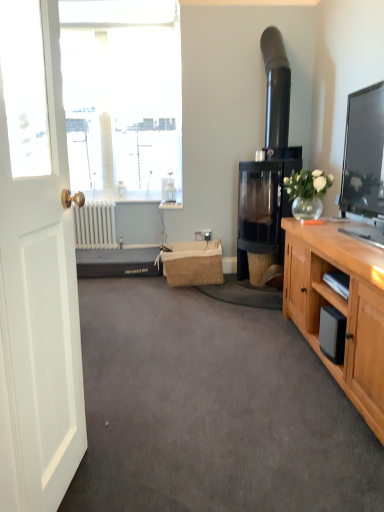
Find the location of a particular element. This screenshot has width=384, height=512. white matte door at left is located at coordinates 39,315.

In order to face black glass fireplace at center-right, should I rotate leftwards or rightwards?

Turn right approximately 11.766 degrees to face it.

Locate an element on the screen. The width and height of the screenshot is (384, 512). burlap picnic basket at center is located at coordinates (193, 263).

This screenshot has height=512, width=384. Describe the element at coordinates (307, 192) in the screenshot. I see `translucent glass vase at upper right` at that location.

Find the location of a particular element. gray carpet at center is located at coordinates (211, 410).

Locate an element on the screen. picnic basket on the right of white matte radiator at lower left is located at coordinates (193, 263).

Relative to white matte radiator at lower left, is burlap picnic basket at center in front or behind?

Clearly, burlap picnic basket at center is in front of white matte radiator at lower left.

Considering the sizes of objects burlap picnic basket at center and white matte radiator at lower left in the image provided, who is taller, burlap picnic basket at center or white matte radiator at lower left?

white matte radiator at lower left.

From a real-world perspective, who is located higher, burlap picnic basket at center or white matte radiator at lower left?

From a 3D spatial view, white matte radiator at lower left is above.

Which of these two, gray carpet at center or white matte radiator at lower left, is thinner?

white matte radiator at lower left is thinner.

Is white matte radiator at lower left at the back of gray carpet at center?

gray carpet at center is not turned away from white matte radiator at lower left.

From the picture: From the image's perspective, which is below, black glass fireplace at center-right or translucent glass vase at upper right?

translucent glass vase at upper right appears lower in the image.

Between point (239, 233) and point (288, 177), which one is positioned in front?

Point (288, 177)

How different are the orientations of black glass fireplace at center-right and translucent glass vase at upper right in degrees?

The facing directions of black glass fireplace at center-right and translucent glass vase at upper right are 1.34 degrees apart.

Is white matte radiator at lower left far away from white matte door at left?

That's right, there is a large distance between white matte radiator at lower left and white matte door at left.

Who is smaller, white matte radiator at lower left or white matte door at left?

With smaller size is white matte radiator at lower left.

Can you confirm if white matte door at left is taller than white matte radiator at lower left?

Correct, white matte door at left is much taller as white matte radiator at lower left.

Is white matte door at left next to white matte radiator at lower left?

No, white matte door at left is not with white matte radiator at lower left.

Looking at this image, considering the relative positions of white matte door at left and white matte radiator at lower left in the image provided, is white matte door at left to the left or to the right of white matte radiator at lower left?

white matte door at left is to the right of white matte radiator at lower left.

From the image's perspective, would you say white matte door at left is shown under burlap picnic basket at center?

Yes.

Looking at their sizes, would you say white matte door at left is wider or thinner than burlap picnic basket at center?

In the image, white matte door at left appears to be wider than burlap picnic basket at center.

Where is `picnic basket above the white matte door at left (from the image's perspective)`? The image size is (384, 512). picnic basket above the white matte door at left (from the image's perspective) is located at coordinates (193, 263).

Is black glass fireplace at center-right at the back of translucent glass vase at upper right?

→ No.

Considering their positions, is translucent glass vase at upper right located in front of or behind black glass fireplace at center-right?

translucent glass vase at upper right is in front of black glass fireplace at center-right.

Considering the sizes of objects translucent glass vase at upper right and black glass fireplace at center-right in the image provided, who is taller, translucent glass vase at upper right or black glass fireplace at center-right?

Standing taller between the two is black glass fireplace at center-right.

Can we say translucent glass vase at upper right lies outside black glass fireplace at center-right?

Yes, translucent glass vase at upper right is located beyond the bounds of black glass fireplace at center-right.

You are a GUI agent. You are given a task and a screenshot of the screen. Output one action in this format:
    pyautogui.click(x=<x>, y=<y>)
    Task: Click on the radiator located behind the burlap picnic basket at center
    This screenshot has height=512, width=384.
    Given the screenshot: What is the action you would take?
    pyautogui.click(x=95, y=225)

At what (x,y) coordinates should I click in order to perform the action: click on plain on the right of the white matte radiator at lower left. Please return your answer as a coordinate pair (x, y). Looking at the image, I should click on (211, 410).

Estimate the real-world distances between objects in this image. Which object is closer to burlap picnic basket at center, gray carpet at center or translucent glass vase at upper right?

translucent glass vase at upper right lies closer to burlap picnic basket at center than the other object.

When comparing their distances from translucent glass vase at upper right, does black glass fireplace at center-right or white matte door at left seem further?

Based on the image, white matte door at left appears to be further to translucent glass vase at upper right.

Considering their positions, is white matte door at left positioned closer to burlap picnic basket at center than white matte radiator at lower left?

Based on the image, white matte radiator at lower left appears to be nearer to burlap picnic basket at center.

Looking at the image, which one is located closer to translucent glass vase at upper right, gray carpet at center or black glass fireplace at center-right?

black glass fireplace at center-right is closer to translucent glass vase at upper right.

Considering their positions, is black glass fireplace at center-right positioned further to white matte radiator at lower left than burlap picnic basket at center?

The object further to white matte radiator at lower left is black glass fireplace at center-right.

Considering their positions, is black glass fireplace at center-right positioned closer to white matte radiator at lower left than translucent glass vase at upper right?

black glass fireplace at center-right lies closer to white matte radiator at lower left than the other object.

Looking at the image, which one is located closer to burlap picnic basket at center, translucent glass vase at upper right or gray carpet at center?

Based on the image, translucent glass vase at upper right appears to be nearer to burlap picnic basket at center.

From the image, which object appears to be farther from white matte radiator at lower left, black glass fireplace at center-right or gray carpet at center?

gray carpet at center lies further to white matte radiator at lower left than the other object.

Locate an element on the screen. plain between white matte door at left and burlap picnic basket at center in the front-back direction is located at coordinates tap(211, 410).

The image size is (384, 512). I want to click on houseplant between white matte door at left and burlap picnic basket at center along the z-axis, so click(307, 192).

I want to click on plain between white matte door at left and translucent glass vase at upper right along the z-axis, so click(x=211, y=410).

This screenshot has width=384, height=512. Find the location of `picnic basket positioned between translucent glass vase at upper right and white matte radiator at lower left from near to far`. picnic basket positioned between translucent glass vase at upper right and white matte radiator at lower left from near to far is located at coordinates (193, 263).